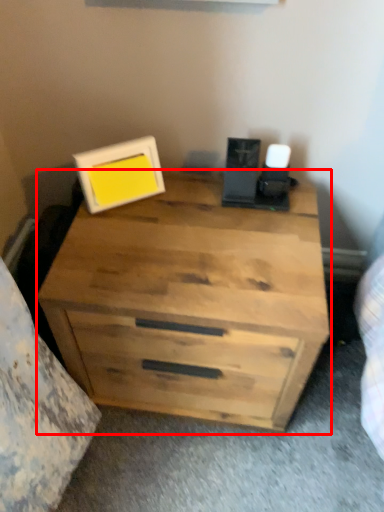
Question: From the image's perspective, where is chest of drawers (annotated by the red box) located relative to picture frame?

Choices:
 (A) above
 (B) below

Answer: (B)